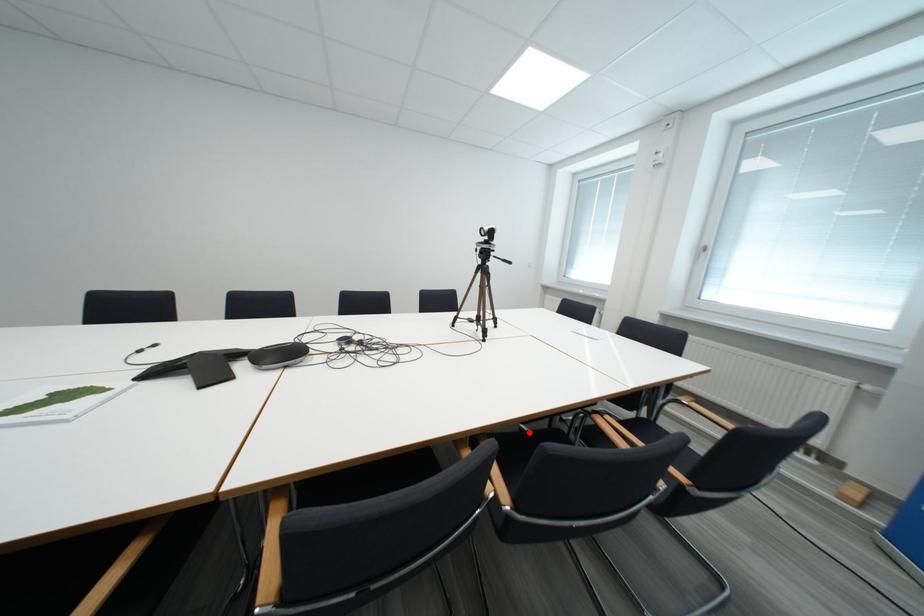
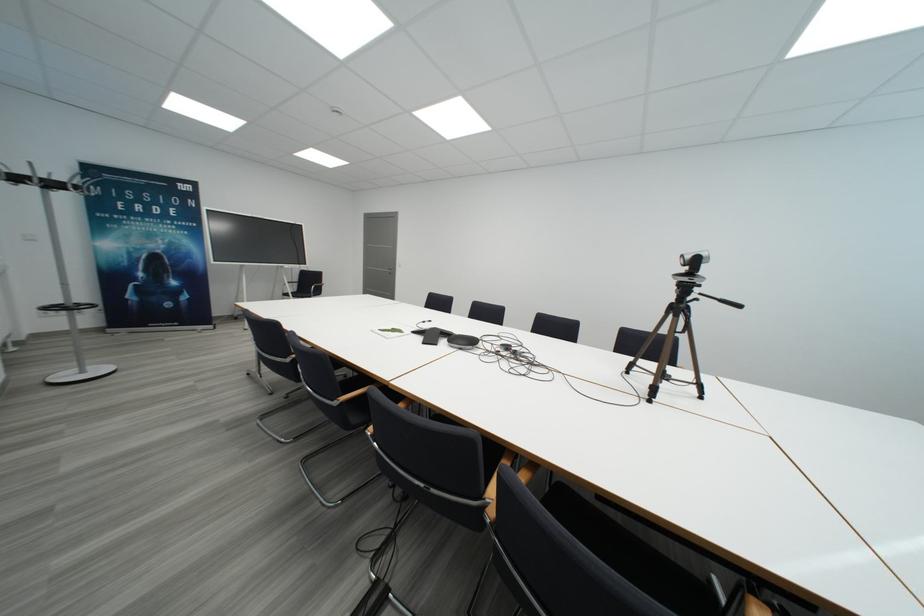
Find the pixel in the second image that matches the highlighted location in the first image.

(718, 586)